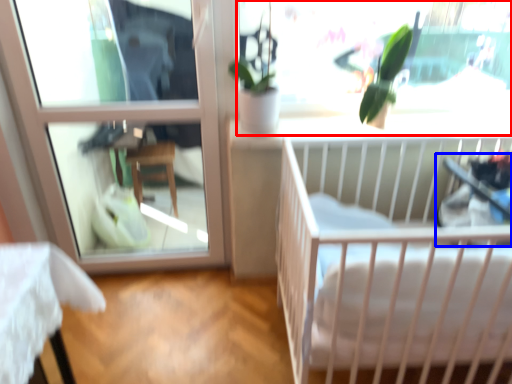
Question: Which object is further to the camera taking this photo, window screen (highlighted by a red box) or baby carriage (highlighted by a blue box)?

Choices:
 (A) window screen
 (B) baby carriage

Answer: (A)